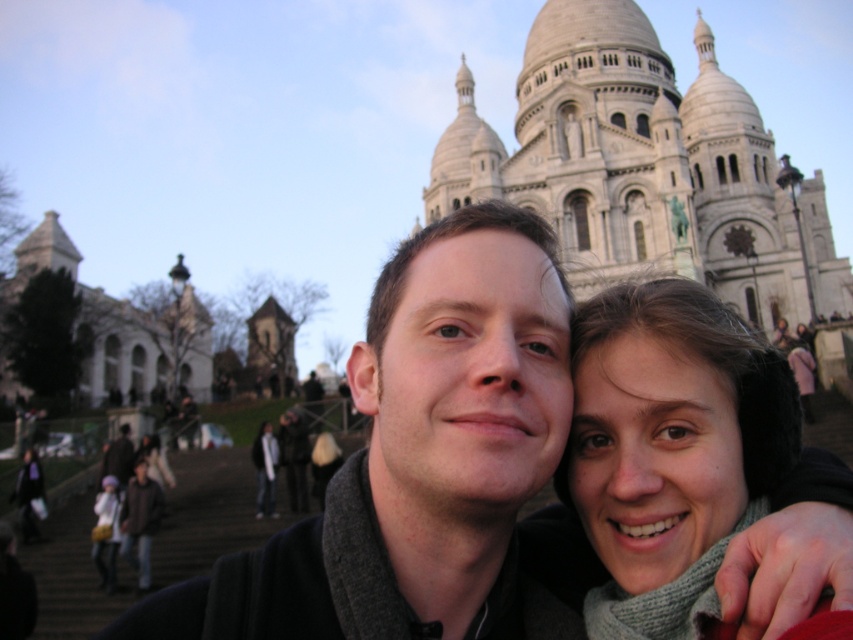
Is gray knitted scarf at center positioned at the back of matte gray scarf at lower center?

No, it is in front of matte gray scarf at lower center.

Is gray knitted scarf at center to the right of matte gray scarf at lower center from the viewer's perspective?

Indeed, gray knitted scarf at center is positioned on the right side of matte gray scarf at lower center.

The image size is (853, 640). What do you see at coordinates (670, 428) in the screenshot? I see `gray knitted scarf at center` at bounding box center [670, 428].

This screenshot has height=640, width=853. In order to click on gray knitted scarf at center in this screenshot , I will do `click(670, 428)`.

Between matte black jacket at center and gray knitted scarf at center, which one has more height?

matte black jacket at center is taller.

Measure the distance between matte black jacket at center and camera.

matte black jacket at center is 131.55 feet away from camera.

Locate an element on the screen. Image resolution: width=853 pixels, height=640 pixels. matte black jacket at center is located at coordinates (421, 460).

Does matte black jacket at center have a lesser width compared to matte gray scarf at lower center?

No, matte black jacket at center is not thinner than matte gray scarf at lower center.

Who is more forward, (471, 422) or (253, 451)?

Point (471, 422)

Locate an element on the screen. This screenshot has height=640, width=853. matte black jacket at center is located at coordinates (421, 460).